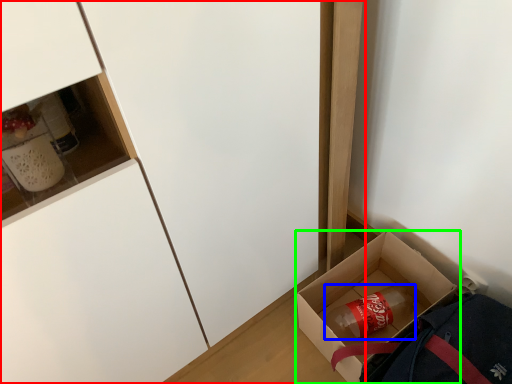
Question: Based on their relative distances, which object is farther from cabinetry (highlighted by a red box)? Choose from beverage (highlighted by a blue box) and box (highlighted by a green box).

Choices:
 (A) beverage
 (B) box

Answer: (A)